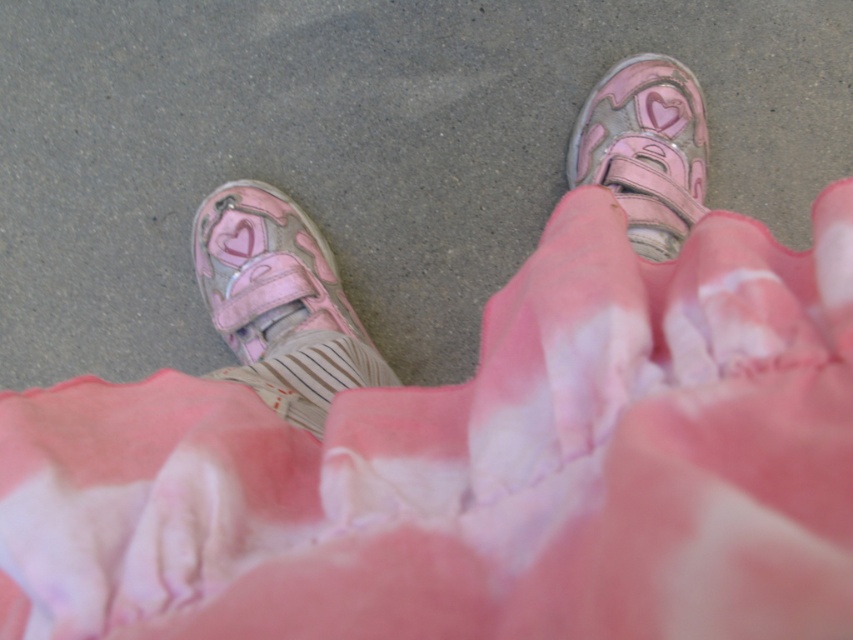
You are a photographer trying to capture the best angle of the pink sneakers with heart patterns. You notice two points marked in the image at coordinates point [308,365] and point [572,182]. Which point is closer to you and should you focus on to get a clearer shot of the sneakers?

Point [308,365] is closer to the viewer than point [572,182], so you should focus on point [308,365] to get a clearer shot of the sneakers.

You are a photographer setting up a shoot. You need to place a 16 inch wide prop between the pink matte shoe at lower left and the shiny pink velcro shoe at center. Is there enough space?

The distance between the pink matte shoe at lower left and the shiny pink velcro shoe at center is 17.29 inches. Since the prop is 16 inches wide, there is enough space to place it between them.

You are standing in a park and see a person wearing pink sneakers with heart patterns and striped socks. There is a point marked at coordinates (279, 301). Can you tell me which object is located at that point?

The pink matte shoe at lower left is located at point (279, 301).